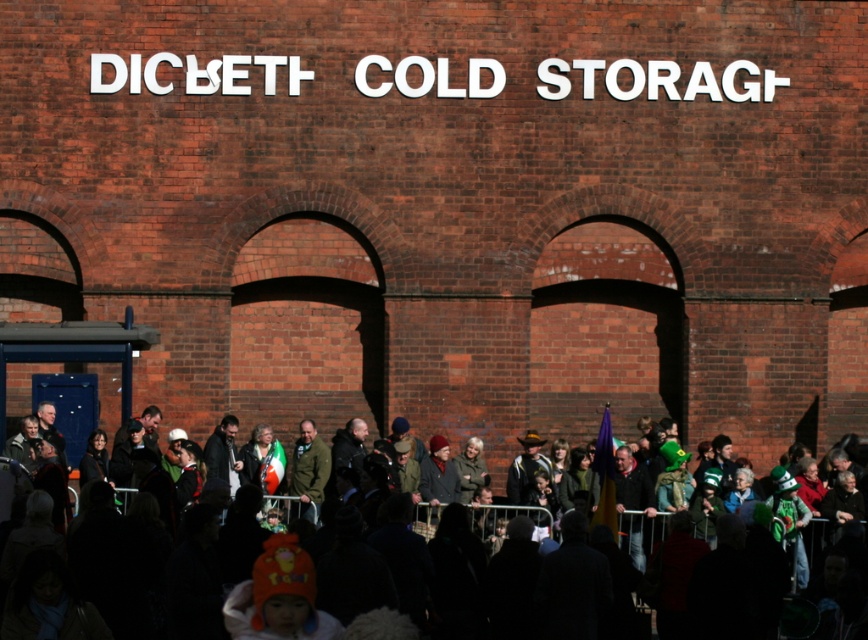
Consider the image. Can you confirm if dark clothing crowd at center is positioned below green fabric jacket at center?

Indeed, dark clothing crowd at center is positioned under green fabric jacket at center.

Identify the location of dark clothing crowd at center. (823, 532).

What do you see at coordinates (823, 532) in the screenshot?
I see `dark clothing crowd at center` at bounding box center [823, 532].

Where is `dark clothing crowd at center`? The width and height of the screenshot is (868, 640). dark clothing crowd at center is located at coordinates point(823,532).